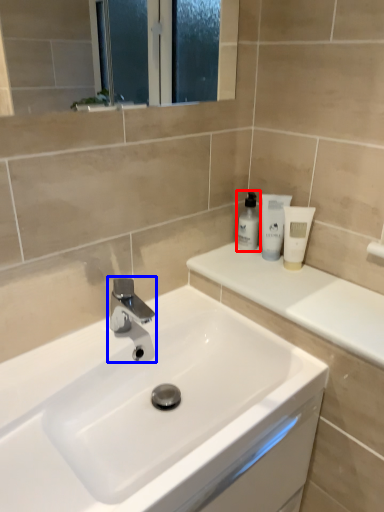
Question: Which object is closer to the camera taking this photo, toiletry (highlighted by a red box) or tap (highlighted by a blue box)?

Choices:
 (A) toiletry
 (B) tap

Answer: (B)